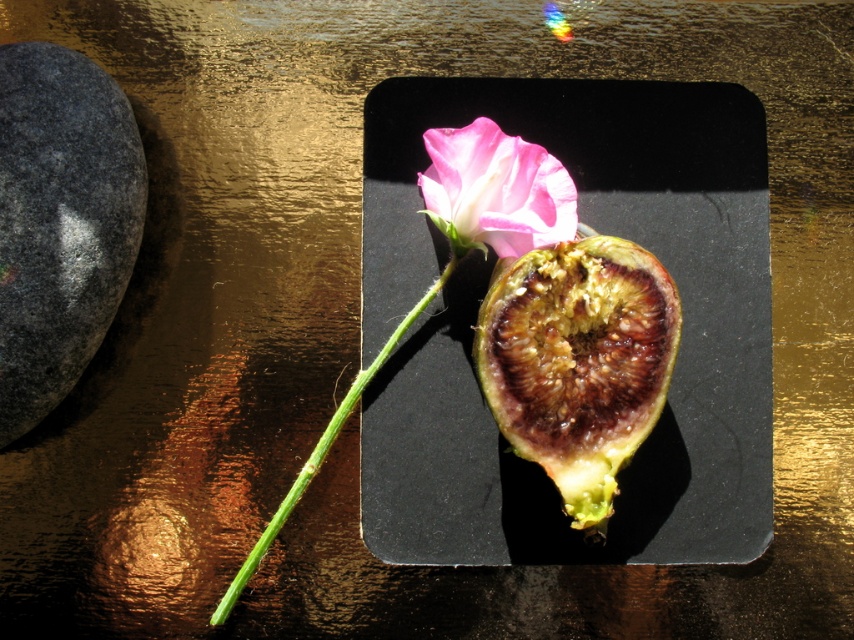
Between brown fibrous fig at center and pink matte flower at center, which one has less height?

pink matte flower at center

Locate an element on the screen. The image size is (854, 640). brown fibrous fig at center is located at coordinates (578, 362).

Find the location of a particular element. brown fibrous fig at center is located at coordinates (578, 362).

Is point (594, 500) less distant than point (354, 401)?

Yes, it is.

Is brown fibrous fig at center below green smooth stem at center?

No.

Where is `brown fibrous fig at center`? brown fibrous fig at center is located at coordinates (578, 362).

Does gray granite rock at left appear over brown fibrous fig at center?

Yes, gray granite rock at left is above brown fibrous fig at center.

Which is behind, point (13, 275) or point (623, 429)?

Positioned behind is point (623, 429).

Find the location of a particular element. gray granite rock at left is located at coordinates (60, 221).